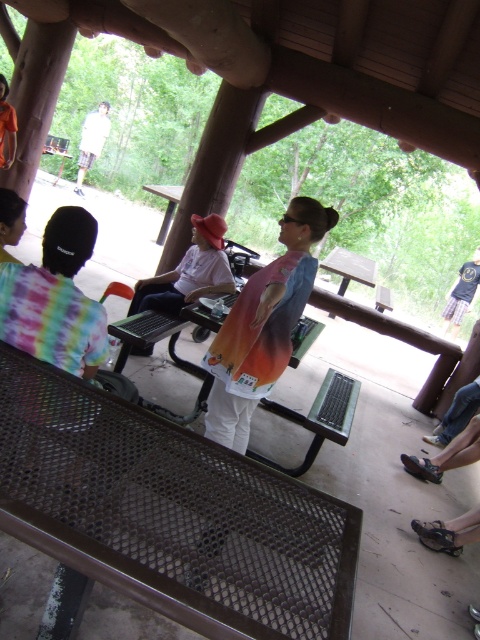
Question: Does gradient tie-dye shirt at center have a larger size compared to brown metal picnic table at center?

Choices:
 (A) no
 (B) yes

Answer: (A)

Question: Is gradient tie-dye shirt at center positioned behind brown metal picnic table at center?

Choices:
 (A) yes
 (B) no

Answer: (B)

Question: Which of the following is the closest to the observer?

Choices:
 (A) gradient tie-dye shirt at center
 (B) brown metal picnic table at center
 (C) brown metal bench at center

Answer: (C)

Question: Observing the image, what is the correct spatial positioning of brown metal bench at center in reference to gradient tie-dye shirt at center?

Choices:
 (A) below
 (B) above

Answer: (A)

Question: Which object is closer to the camera taking this photo?

Choices:
 (A) gradient tie-dye shirt at center
 (B) brown metal picnic table at center

Answer: (A)

Question: Which of the following is the farthest from the observer?

Choices:
 (A) (276, 356)
 (B) (144, 189)
 (C) (104, 458)

Answer: (B)